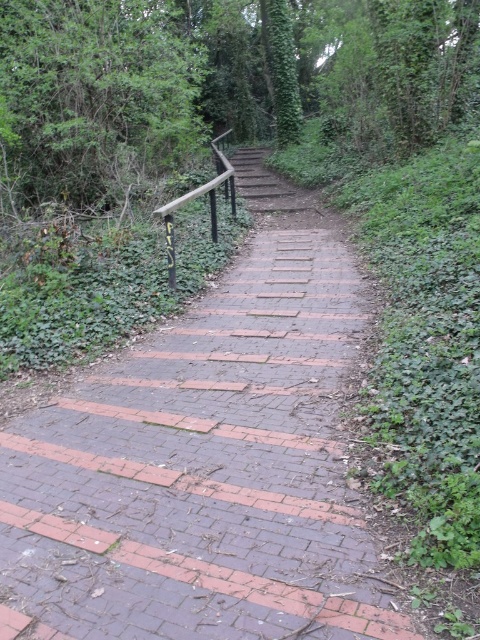
Question: Is brick at center positioned in front of green leafy tree at upper left?

Choices:
 (A) no
 (B) yes

Answer: (B)

Question: Does green leafy tree at upper left lie behind wooden rail at upper center?

Choices:
 (A) yes
 (B) no

Answer: (A)

Question: Where is brick at center located in relation to wooden rail at upper center in the image?

Choices:
 (A) above
 (B) below

Answer: (B)

Question: Which point is farther to the camera?

Choices:
 (A) (273, 515)
 (B) (178, 198)
 (C) (141, 99)

Answer: (B)

Question: Which object is positioned farthest from the brick at center?

Choices:
 (A) green leafy tree at upper left
 (B) wooden rail at upper center

Answer: (A)

Question: Which object is farther from the camera taking this photo?

Choices:
 (A) wooden rail at upper center
 (B) green leafy tree at upper left

Answer: (B)